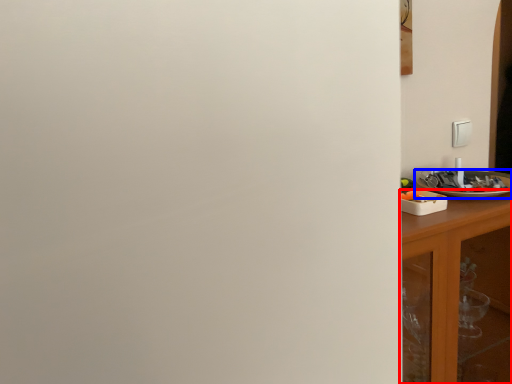
Question: Which object appears closest to the camera in this image, cabinetry (highlighted by a red box) or tableware (highlighted by a blue box)?

Choices:
 (A) cabinetry
 (B) tableware

Answer: (A)